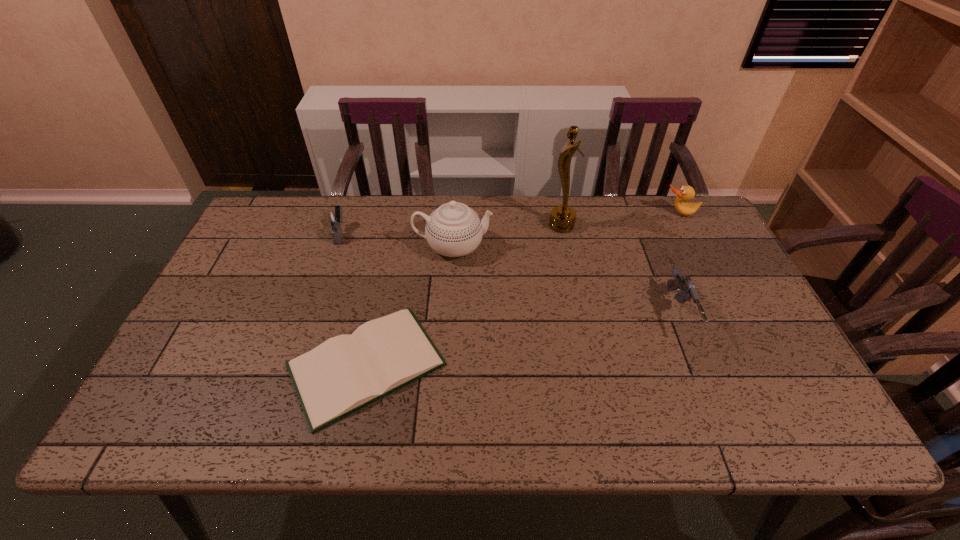
Locate an element on the screen. The width and height of the screenshot is (960, 540). free space between the rightmost object and the gun is located at coordinates (679, 264).

Locate an element on the screen. The width and height of the screenshot is (960, 540). vacant area that lies between the award and the shortest object is located at coordinates (464, 295).

Image resolution: width=960 pixels, height=540 pixels. I want to click on free point between the tallest object and the rightmost object, so [620, 220].

Identify the location of free area in between the gun and the hardback book. This screenshot has width=960, height=540. (522, 340).

I want to click on free space between the tallest object and the duck, so click(x=620, y=220).

In order to click on unoccupied position between the rightmost object and the igniter in this screenshot , I will do `click(510, 224)`.

Identify the location of free space between the igniter and the hardback book. Image resolution: width=960 pixels, height=540 pixels. (353, 299).

Locate an element on the screen. object that stands as the third closest to the tallest object is located at coordinates 686,193.

Find the location of `object identified as the closest to the gun`. object identified as the closest to the gun is located at coordinates (562, 219).

Locate an element on the screen. vacant region that satisfies the following two spatial constraints: 1. on the beak of the duck; 2. on the spout of the fifth shortest object is located at coordinates (696, 247).